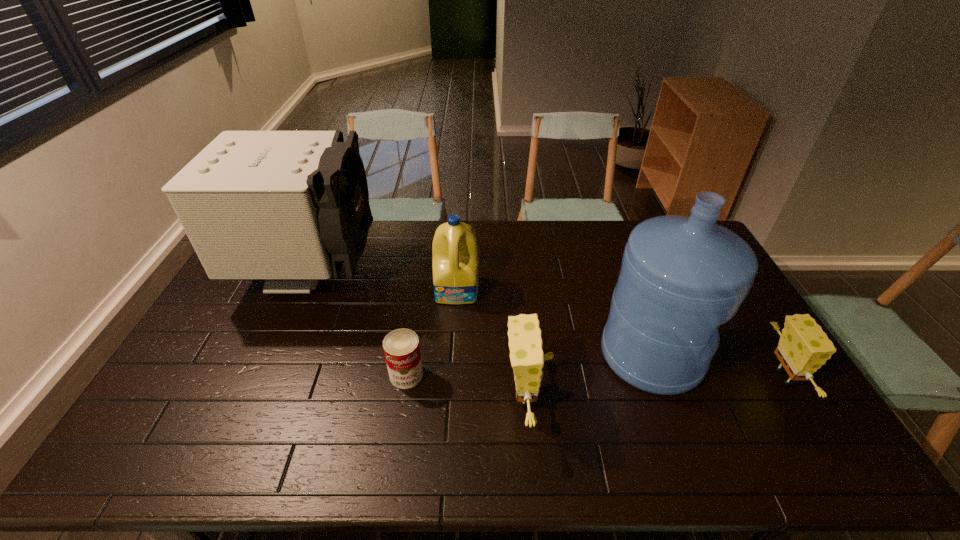
Where is `free space that is in between the leftmost object and the can`? Image resolution: width=960 pixels, height=540 pixels. free space that is in between the leftmost object and the can is located at coordinates (358, 325).

Locate an element on the screen. The height and width of the screenshot is (540, 960). the third closest object relative to the fifth object from left to right is located at coordinates (455, 263).

Locate which object ranks fifth in proximity to the shortest object. Please provide its 2D coordinates. Your answer should be formatted as a tuple, i.e. [(x, y)], where the tuple contains the x and y coordinates of a point satisfying the conditions above.

[(804, 347)]

The width and height of the screenshot is (960, 540). Identify the location of vacant position in the image that satisfies the following two spatial constraints: 1. on the side of the fifth object from left to right with the handle; 2. on the front label of the fifth object from right to left. (659, 375).